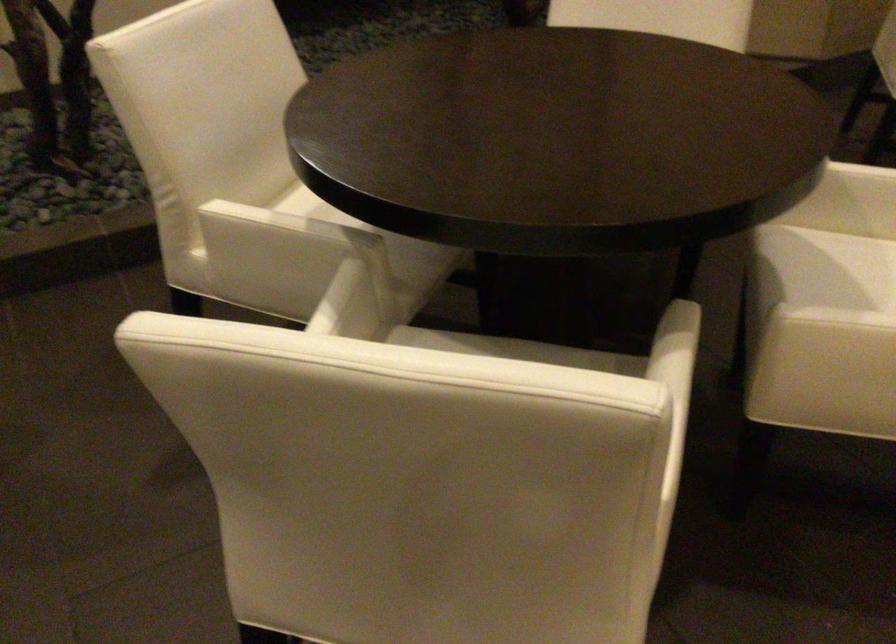
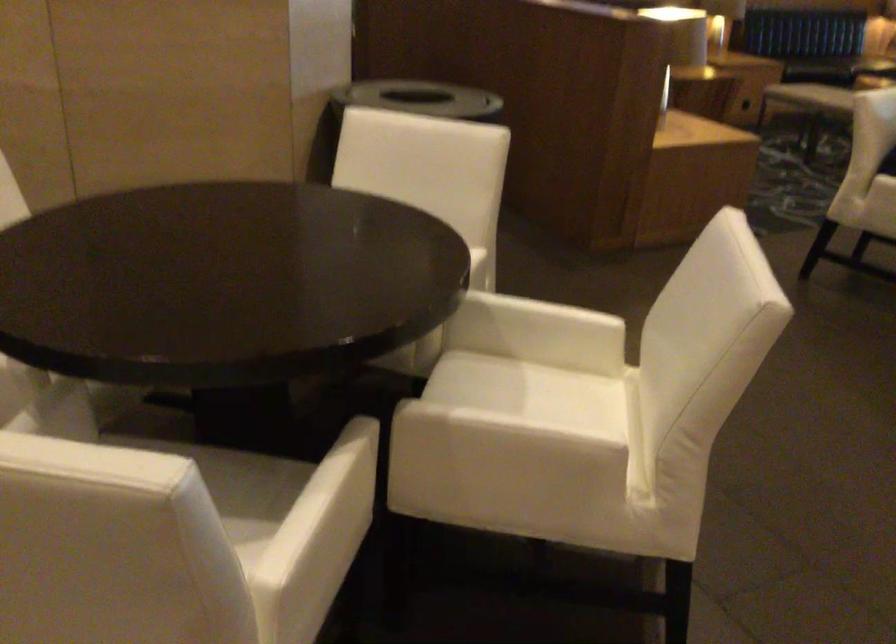
Question: The images are taken continuously from a first-person perspective. In which direction are you moving?

Choices:
 (A) Left
 (B) Right
 (C) Forward
 (D) Backward

Answer: (B)